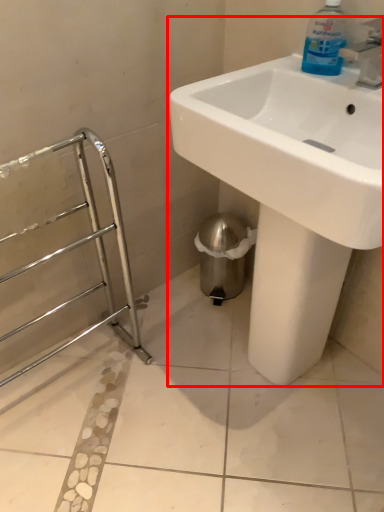
Question: Observing the image, what is the correct spatial positioning of sink (annotated by the red box) in reference to cleaning product?

Choices:
 (A) left
 (B) right

Answer: (A)